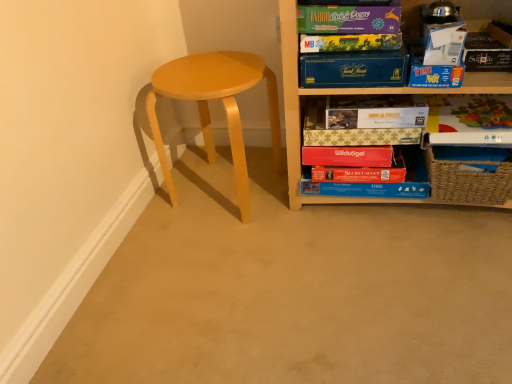
Question: From a real-world perspective, is blue cardboard puzzle at lower center positioned above or below matte cardboard game at upper right, placed as the 2th paperback book when sorted from top to bottom?

Choices:
 (A) below
 (B) above

Answer: (A)

Question: Based on their sizes in the image, would you say blue cardboard puzzle at lower center is bigger or smaller than matte cardboard game at upper right, placed as the 2th paperback book when sorted from top to bottom?

Choices:
 (A) big
 (B) small

Answer: (A)

Question: Which is farther from the matte cardboard game at upper right, placed as the 2th paperback book when sorted from top to bottom?

Choices:
 (A) matte purple board game at upper right, placed as the 1th paperback book when sorted from top to bottom
 (B) matte cardboard book at right, which is the 2th paperback book from bottom to top
 (C) matte cardboard book at upper center, which is counted as the 4th paperback book, starting from the top
 (D) matte yellow stool at left
 (E) blue cardboard puzzle at lower center

Answer: (E)

Question: Which is farther from the matte purple board game at upper right, the sixth paperback book in the bottom-to-top sequence?

Choices:
 (A) red matte paper at lower center, acting as the first paperback book starting from the bottom
 (B) matte cardboard book at right, the 5th paperback book in the top-to-bottom sequence
 (C) matte cardboard book at upper center, which ranks as the 3th paperback book in bottom-to-top order
 (D) blue cardboard box at upper center, acting as the third paperback book starting from the top
 (E) matte yellow stool at left

Answer: (A)